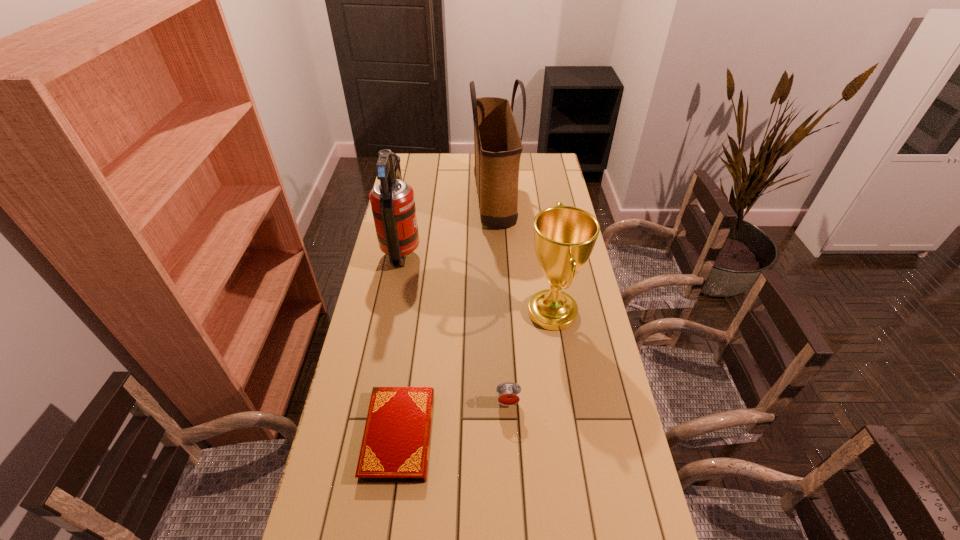
At what (x,y) coordinates should I click in order to perform the action: click on vacant space located by the handles of the third tallest object. Please return your answer as a coordinate pair (x, y). The width and height of the screenshot is (960, 540). Looking at the image, I should click on (472, 312).

In order to click on free region located 0.300m on the face of the second shortest object in this screenshot , I will do `click(514, 524)`.

Locate an element on the screen. The width and height of the screenshot is (960, 540). vacant point located on the cover of the hardback book is located at coordinates (386, 532).

Find the location of a particular element. object present at the far edge is located at coordinates (497, 143).

This screenshot has width=960, height=540. Find the location of `fire extinguisher at the left edge`. fire extinguisher at the left edge is located at coordinates (392, 200).

Where is `hardback book positioned at the left edge`? The width and height of the screenshot is (960, 540). hardback book positioned at the left edge is located at coordinates (395, 447).

Where is `object that is at the right edge`? This screenshot has height=540, width=960. object that is at the right edge is located at coordinates (564, 236).

In the image, there is a desktop. At what (x,y) coordinates should I click in order to perform the action: click on free space at the far edge. Please return your answer as a coordinate pair (x, y). Looking at the image, I should click on (465, 160).

Find the location of `free space at the left edge of the desktop`. free space at the left edge of the desktop is located at coordinates (354, 353).

I want to click on vacant space at the right edge, so click(588, 441).